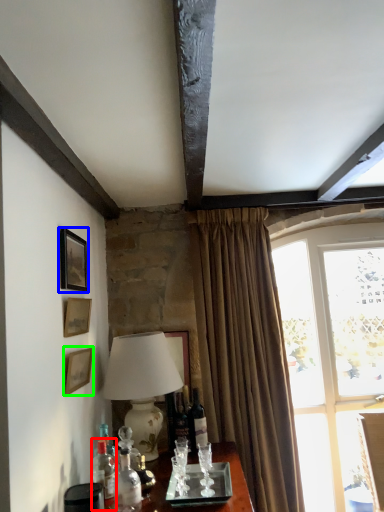
Question: Based on their relative distances, which object is nearer to bottle (highlighted by a red box)? Choose from picture frame (highlighted by a blue box) and picture frame (highlighted by a green box).

Choices:
 (A) picture frame
 (B) picture frame

Answer: (B)